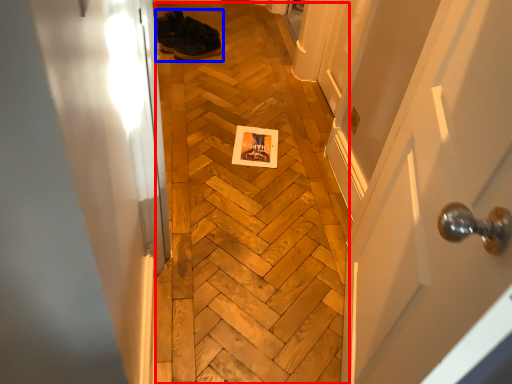
Question: Which object appears farthest to the camera in this image, plywood (highlighted by a red box) or footwear (highlighted by a blue box)?

Choices:
 (A) plywood
 (B) footwear

Answer: (B)